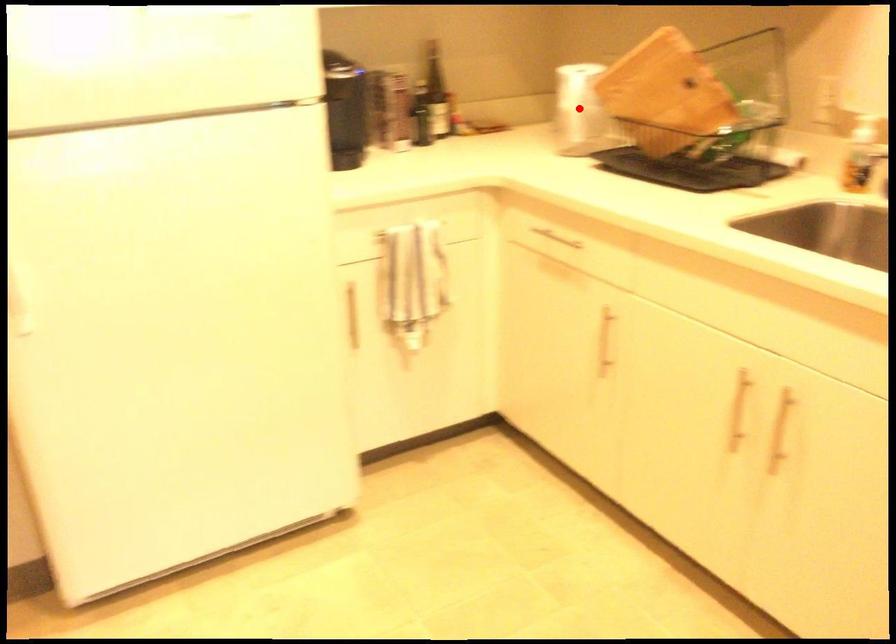
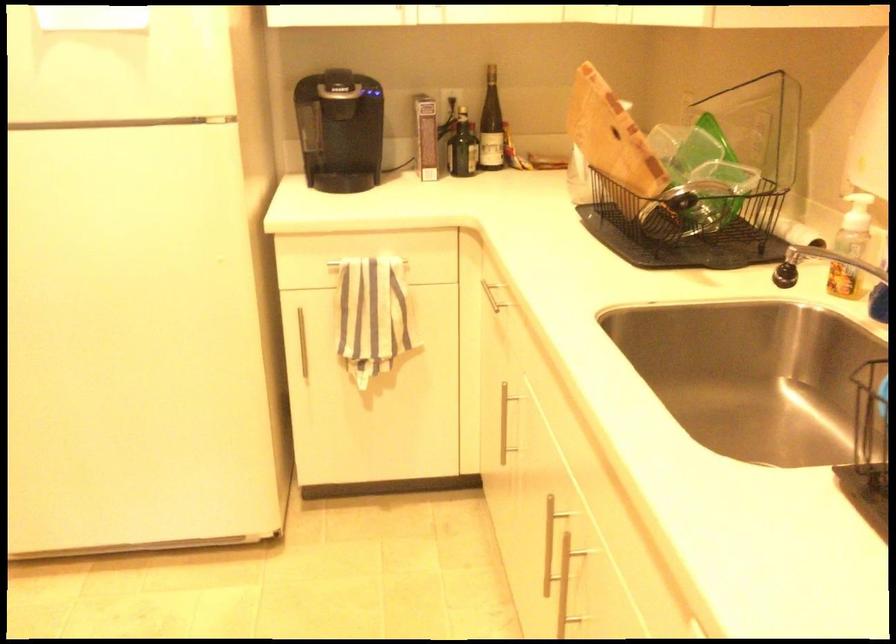
Question: I am providing you with two images of the same scene from different viewpoints. A red point is marked on the first image. At the location where the point appears in image 1, is it still visible in image 2?

Choices:
 (A) Yes
 (B) No

Answer: (B)